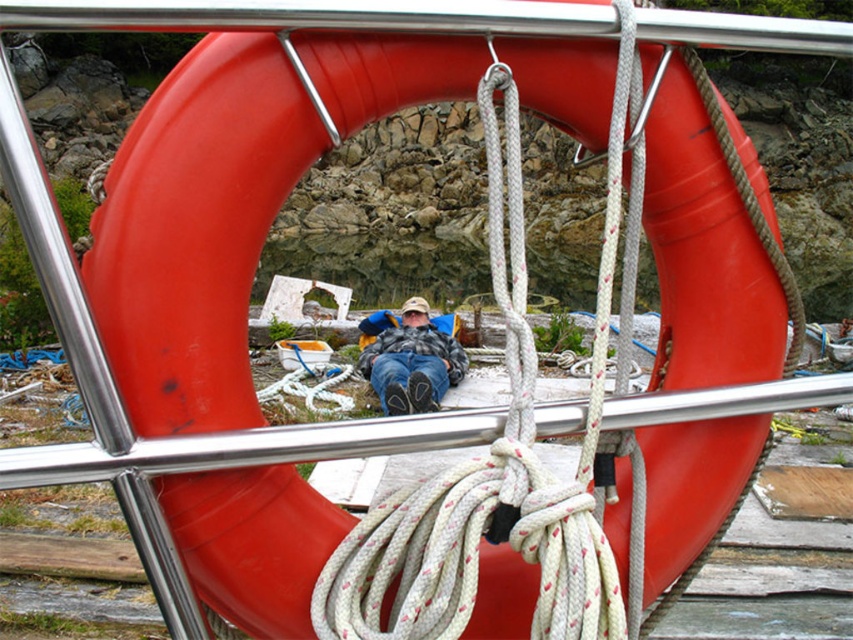
Is point (630, 579) closer to viewer compared to point (369, 352)?

Yes, point (630, 579) is in front of point (369, 352).

Between white textured rope at center and flannel shirt at center, which one has more height?

white textured rope at center is taller.

Who is more forward, (527, 506) or (398, 384)?

Point (527, 506)

Identify the location of white textured rope at center. coord(500,461).